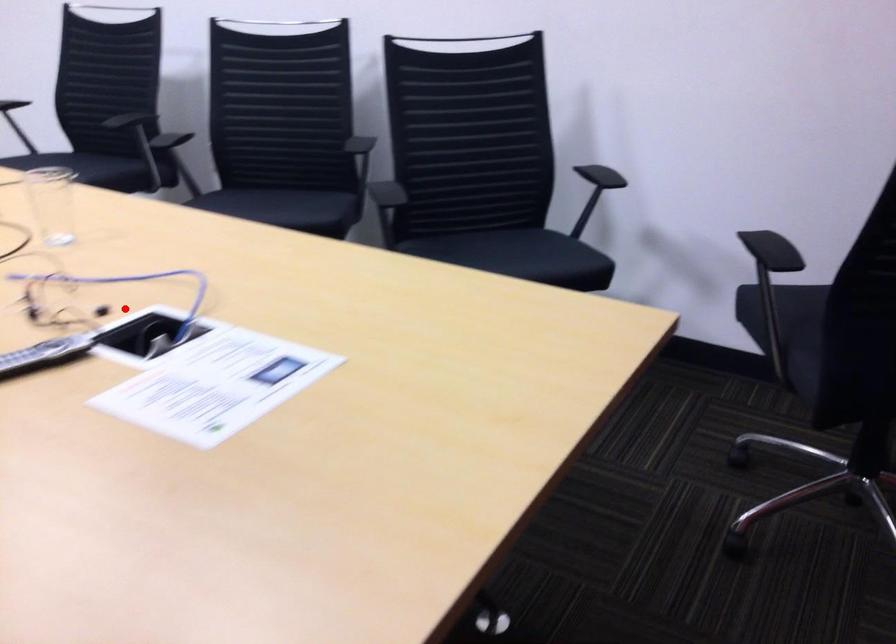
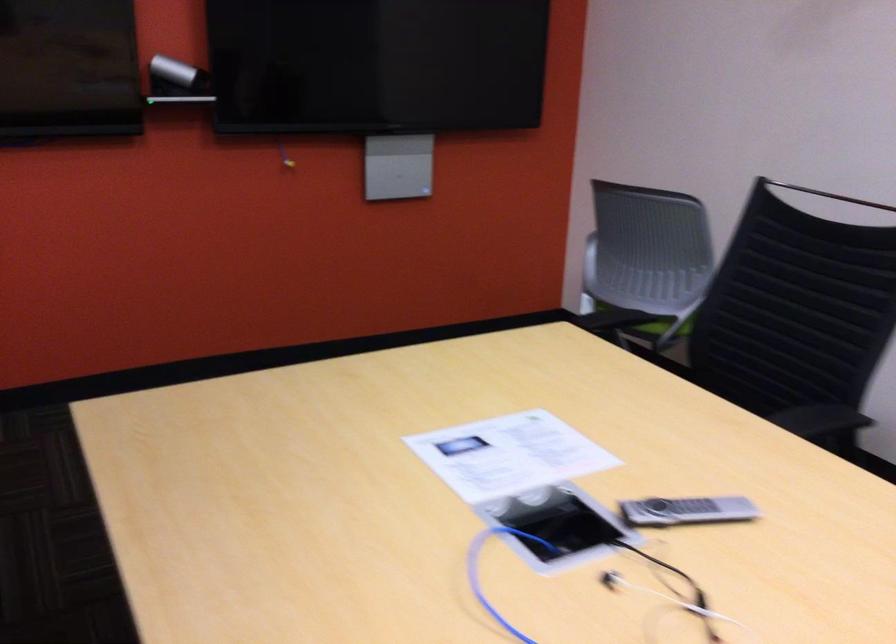
The point at the highlighted location is marked in the first image. Where is the corresponding point in the second image?

(576, 583)